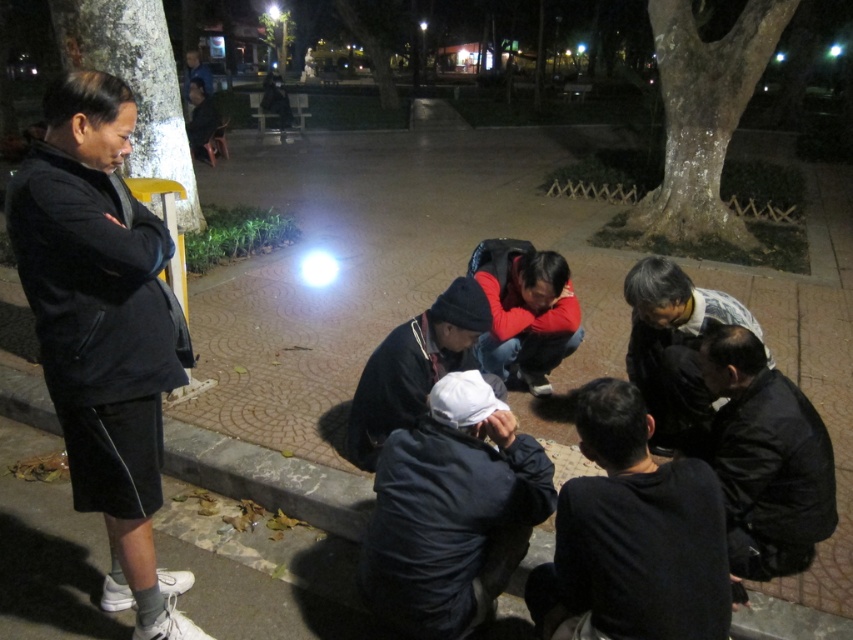
Is dark blue fabric cap at lower center below black matte jacket at center?

Yes.

Between point (457, 451) and point (352, 429), which one is positioned behind?

Point (352, 429)

Identify the location of dark blue fabric cap at lower center. (451, 512).

Who is taller, black matte jacket at left or dark blue fabric cap at lower center?

With more height is black matte jacket at left.

Can you confirm if black matte jacket at left is shorter than dark blue fabric cap at lower center?

No, black matte jacket at left is not shorter than dark blue fabric cap at lower center.

Identify the location of black matte jacket at left. (102, 330).

The image size is (853, 640). I want to click on black matte jacket at left, so click(x=102, y=330).

Does point (113, 502) lie behind point (549, 352)?

No, (113, 502) is in front of (549, 352).

Locate an element on the screen. black matte jacket at left is located at coordinates (102, 330).